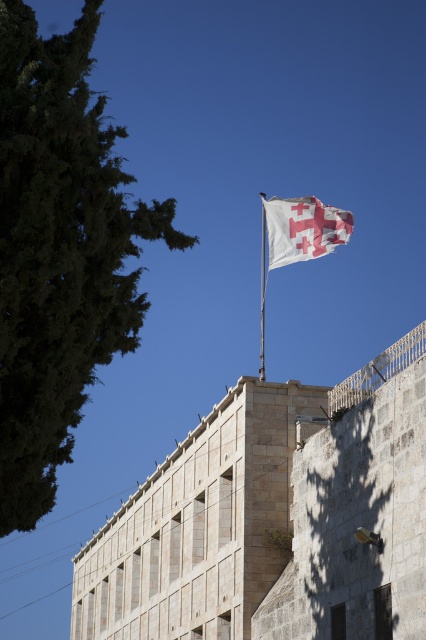
You are a photographer planning to capture the white fabric flag at upper center and the white fabric flag pole at upper center in a single frame. Based on their sizes, which object should you focus on first to ensure both are in focus?

The white fabric flag at upper center has a greater width than the white fabric flag pole at upper center, so focusing on the flag first would ensure both are in focus as the pole is narrower and closer to the background.

You are standing at the center of the image and want to locate the white fabric flag at upper center. According to the coordinates provided, where exactly is it positioned?

The white fabric flag at upper center is positioned at coordinates point (304, 228).

You are standing in front of a building and see the white fabric flag at upper center and the white fabric flag pole at upper center. Which object is closer to you?

The white fabric flag at upper center is closer to you than the white fabric flag pole at upper center.